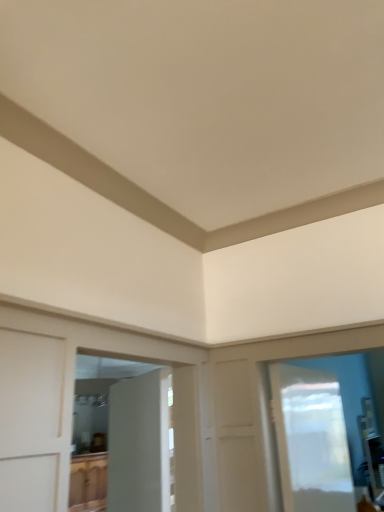
Describe the element at coordinates (139, 444) in the screenshot. I see `white glossy screen door at center` at that location.

Where is `white glossy screen door at center`? white glossy screen door at center is located at coordinates (139, 444).

Identify the location of white glossy screen door at center. (139, 444).